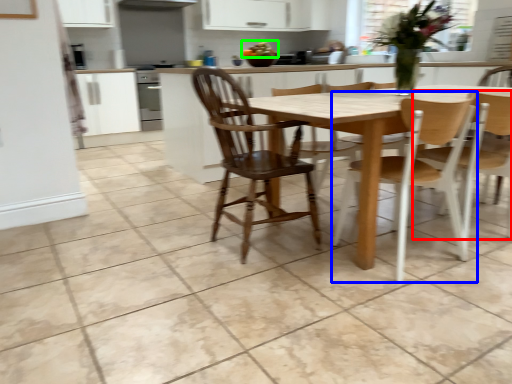
Question: Which is nearer to the chair (highlighted by a red box)? chair (highlighted by a blue box) or food (highlighted by a green box).

Choices:
 (A) chair
 (B) food

Answer: (A)